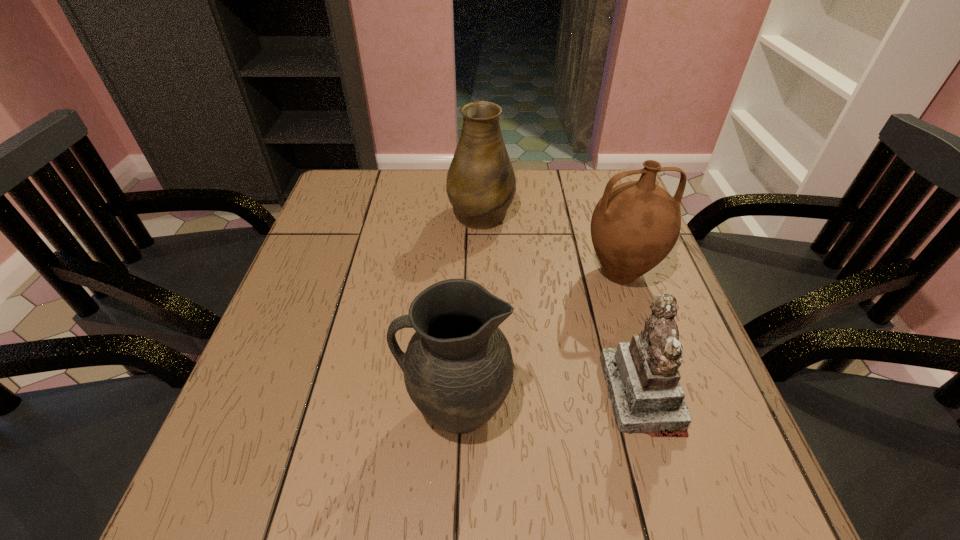
Image resolution: width=960 pixels, height=540 pixels. I want to click on free space between the figurine and the nearest pitcher, so click(549, 402).

Where is `vacant area that lies between the nearest pitcher and the third nearest object`? The width and height of the screenshot is (960, 540). vacant area that lies between the nearest pitcher and the third nearest object is located at coordinates (539, 341).

Where is `the closest object to the second farthest pitcher`? This screenshot has width=960, height=540. the closest object to the second farthest pitcher is located at coordinates (642, 377).

The image size is (960, 540). Find the location of `object that is the third nearest to the farthest pitcher`. object that is the third nearest to the farthest pitcher is located at coordinates (458, 368).

I want to click on pitcher that is the second closest to the farthest object, so click(x=458, y=368).

Locate which pitcher is the second closest to the third nearest object. Please provide its 2D coordinates. Your answer should be formatted as a tuple, i.e. [(x, y)], where the tuple contains the x and y coordinates of a point satisfying the conditions above.

[(458, 368)]